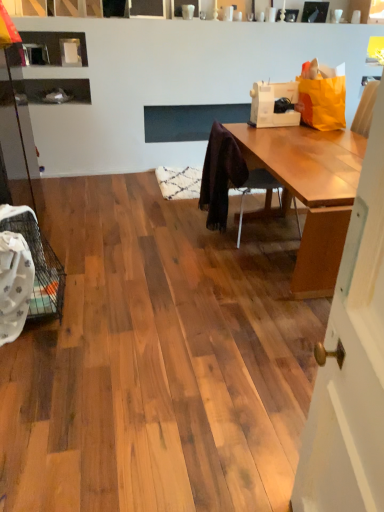
Locate an element on the screen. vacant area that is in front of wooden chair at center is located at coordinates pos(241,263).